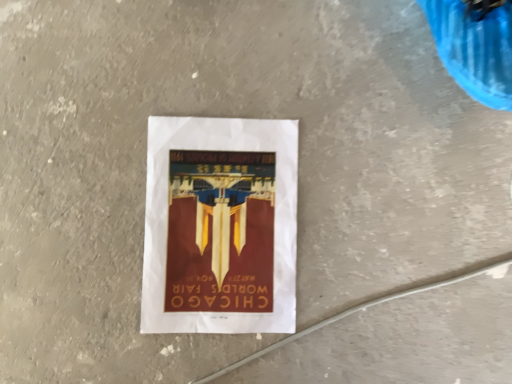
The image size is (512, 384). What are the coordinates of `vacant area on top of matte paper poster at center (from a real-world perspective)` in the screenshot? It's located at (214, 220).